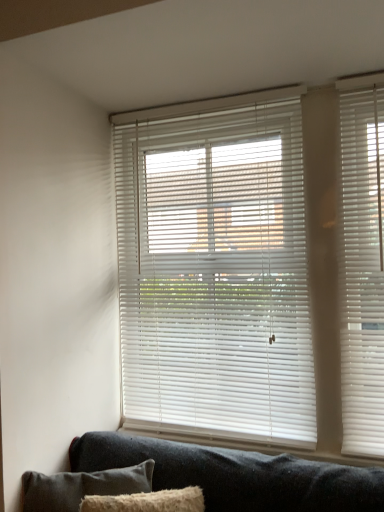
Question: Is dark gray fabric pillow at lower left not near white plastic blinds at center?

Choices:
 (A) no
 (B) yes

Answer: (A)

Question: From a real-world perspective, is dark gray fabric pillow at lower left physically below white plastic blinds at center?

Choices:
 (A) yes
 (B) no

Answer: (A)

Question: From a real-world perspective, is dark gray fabric pillow at lower left on white plastic blinds at center?

Choices:
 (A) no
 (B) yes

Answer: (A)

Question: Does dark gray fabric pillow at lower left have a lesser height compared to white plastic blinds at center?

Choices:
 (A) no
 (B) yes

Answer: (B)

Question: Is dark gray fabric pillow at lower left outside white plastic blinds at center?

Choices:
 (A) no
 (B) yes

Answer: (B)

Question: Considering the relative sizes of dark gray fabric pillow at lower left and white plastic blinds at center in the image provided, is dark gray fabric pillow at lower left bigger than white plastic blinds at center?

Choices:
 (A) yes
 (B) no

Answer: (B)

Question: Does white plastic blinds at center turn towards dark gray fabric pillow at lower left?

Choices:
 (A) yes
 (B) no

Answer: (A)

Question: From the image's perspective, is white plastic blinds at center over dark gray fabric pillow at lower left?

Choices:
 (A) yes
 (B) no

Answer: (A)

Question: Considering the relative sizes of white plastic blinds at center and dark gray fabric pillow at lower left in the image provided, is white plastic blinds at center taller than dark gray fabric pillow at lower left?

Choices:
 (A) yes
 (B) no

Answer: (A)

Question: From a real-world perspective, is white plastic blinds at center over dark gray fabric pillow at lower left?

Choices:
 (A) no
 (B) yes

Answer: (B)

Question: Is white plastic blinds at center not close to dark gray fabric pillow at lower left?

Choices:
 (A) no
 (B) yes

Answer: (A)

Question: Is white plastic blinds at center to the right of dark gray fabric pillow at lower left from the viewer's perspective?

Choices:
 (A) no
 (B) yes

Answer: (B)

Question: Considering the positions of dark gray fabric pillow at lower left and white plastic blinds at center in the image, is dark gray fabric pillow at lower left bigger or smaller than white plastic blinds at center?

Choices:
 (A) small
 (B) big

Answer: (A)